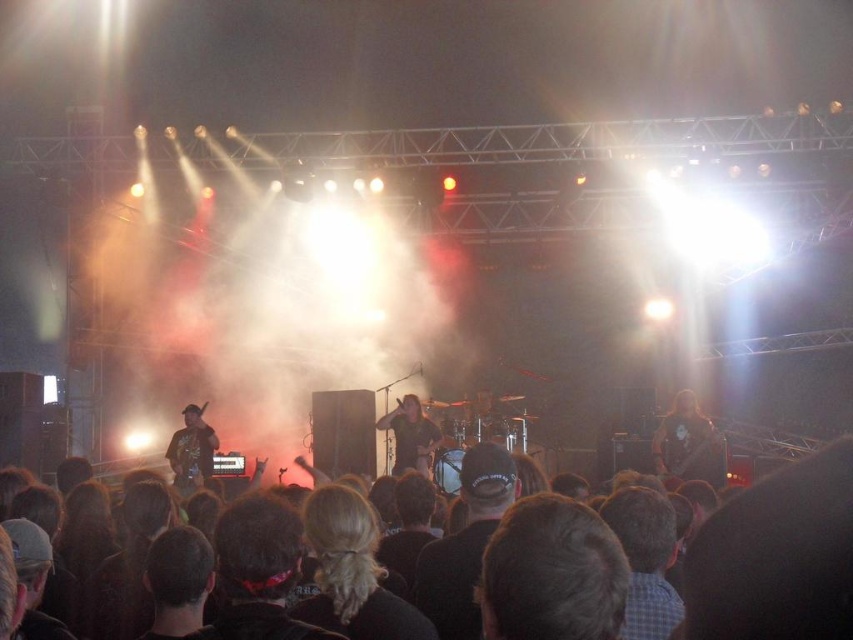
You are a photographer trying to capture a clear shot of both the green fabric guitar at left and the shiny black guitar at center during the concert. Since you want both guitars to be in focus, which one should you focus on first to ensure the other is also in focus?

You should focus on the shiny black guitar at center first because it is further away than the green fabric guitar at left, so focusing on the further object will help both be in focus.

You are a photographer at the concert. You want to capture a photo of the dark brown hair at center and the dark brown leather guitar at center. Based on their positions, which one is closer to the camera?

The dark brown hair at center is located above the dark brown leather guitar at center, which means it is closer to the camera.

You are a photographer at the concert. You want to capture a photo of both the green fabric guitar at left and the shiny black guitar at center. Which guitar should you focus on first if you want to include both in your frame without moving the camera?

The green fabric guitar at left is below the shiny black guitar at center, so you should focus on the shiny black guitar at center first to ensure both are in the frame.